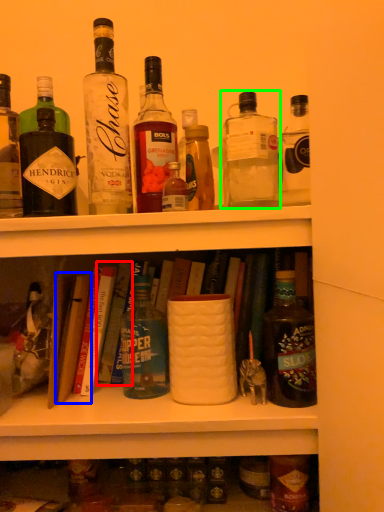
Question: Which object is positioned closest to book (highlighted by a red box)? Select from book (highlighted by a blue box) and bottle (highlighted by a green box).

Choices:
 (A) book
 (B) bottle

Answer: (A)